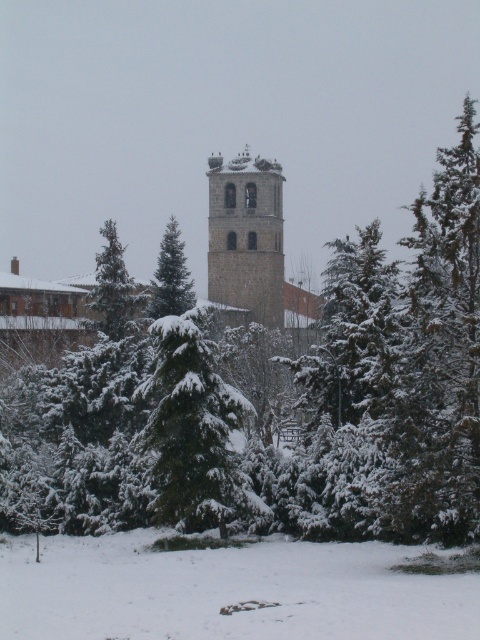
Question: Is gray stone bell tower at center positioned behind green snow-covered tree at center?

Choices:
 (A) yes
 (B) no

Answer: (A)

Question: Is white fluffy snow at lower center below green snow-covered tree at center?

Choices:
 (A) no
 (B) yes

Answer: (B)

Question: Which point is closer to the camera?

Choices:
 (A) gray stone bell tower at center
 (B) snow-covered evergreen at center
 (C) green snow-covered tree at center
 (D) green textured pine tree at center

Answer: (B)

Question: Among these points, which one is nearest to the camera?

Choices:
 (A) click(121, 321)
 (B) click(151, 420)
 (C) click(330, 593)

Answer: (C)

Question: Which object appears farthest from the camera in this image?

Choices:
 (A) green snow-covered tree at center
 (B) white fluffy snow at lower center
 (C) gray stone bell tower at center

Answer: (C)

Question: Is gray stone bell tower at center bigger than green textured pine tree at center?

Choices:
 (A) no
 (B) yes

Answer: (B)